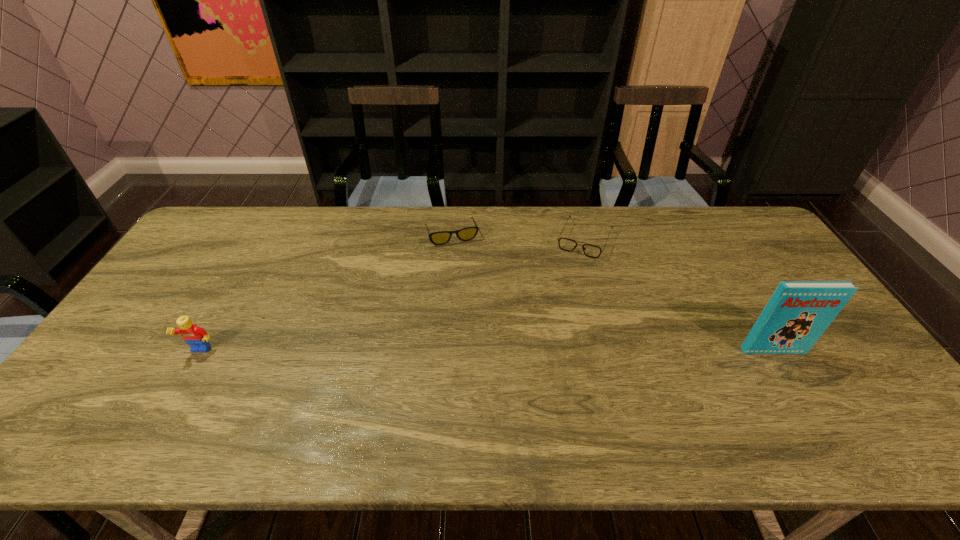
Where is `free location located on the front-facing side of the second object from left to right`? The width and height of the screenshot is (960, 540). free location located on the front-facing side of the second object from left to right is located at coordinates [x=465, y=266].

This screenshot has width=960, height=540. I want to click on vacant position located on the front-facing side of the right sunglasses, so click(541, 341).

You are a GUI agent. You are given a task and a screenshot of the screen. Output one action in this format:
    pyautogui.click(x=<x>, y=<y>)
    Task: Click on the vacant area located 0.280m on the front-facing side of the right sunglasses
    This screenshot has width=960, height=540.
    Given the screenshot: What is the action you would take?
    pyautogui.click(x=551, y=318)

Image resolution: width=960 pixels, height=540 pixels. I want to click on free space located on the front-facing side of the right sunglasses, so click(545, 333).

Locate an element on the screen. This screenshot has width=960, height=540. object that is at the right edge is located at coordinates (797, 314).

What are the coordinates of `vacant space at the far edge` in the screenshot? It's located at (652, 215).

The height and width of the screenshot is (540, 960). I want to click on blank space at the near edge of the desktop, so click(724, 376).

Locate an element on the screen. This screenshot has height=540, width=960. vacant space at the left edge of the desktop is located at coordinates (206, 294).

Where is `free space at the far left corner`? Image resolution: width=960 pixels, height=540 pixels. free space at the far left corner is located at coordinates (231, 218).

This screenshot has height=540, width=960. I want to click on empty space that is in between the leftmost object and the book, so click(x=487, y=351).